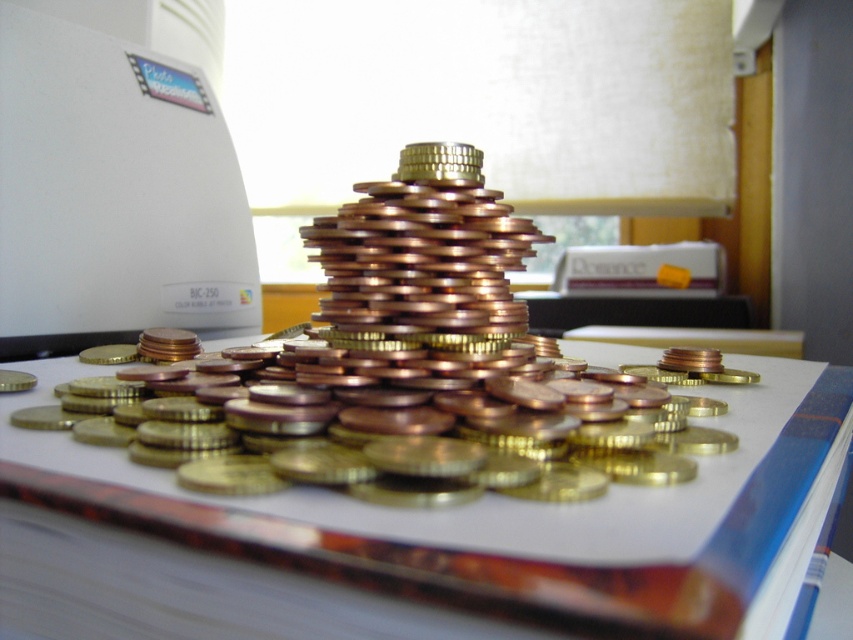
Which is more to the left, metallic gold coins at center or gold shiny coins at center?

Positioned to the left is gold shiny coins at center.

In the scene shown: Is metallic gold coins at center bigger than gold shiny coins at center?

Yes.

Is point (682, 598) less distant than point (289, 362)?

Yes, point (682, 598) is closer to viewer.

I want to click on metallic gold coins at center, so click(512, 518).